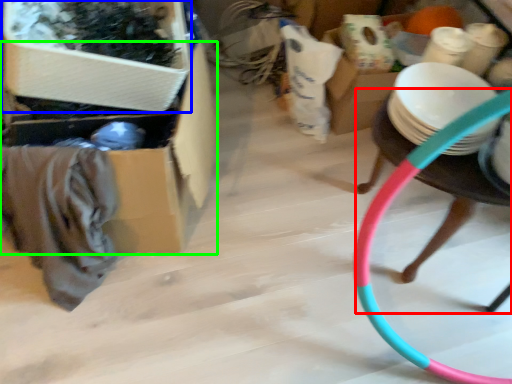
Question: Which object is positioned closest to chair (highlighted by a red box)? Select from storage box (highlighted by a blue box) and storage box (highlighted by a green box).

Choices:
 (A) storage box
 (B) storage box

Answer: (B)